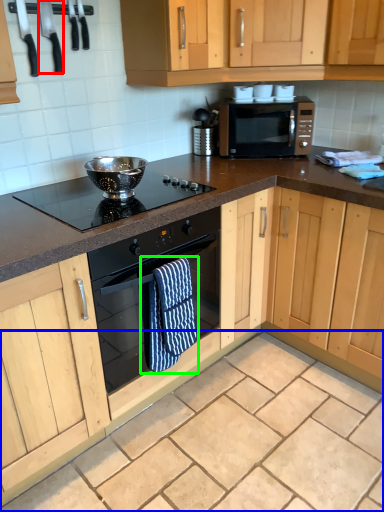
Question: Which is farther away from appliance (highlighted by a red box)? granite (highlighted by a blue box) or bath towel (highlighted by a green box)?

Choices:
 (A) granite
 (B) bath towel

Answer: (A)